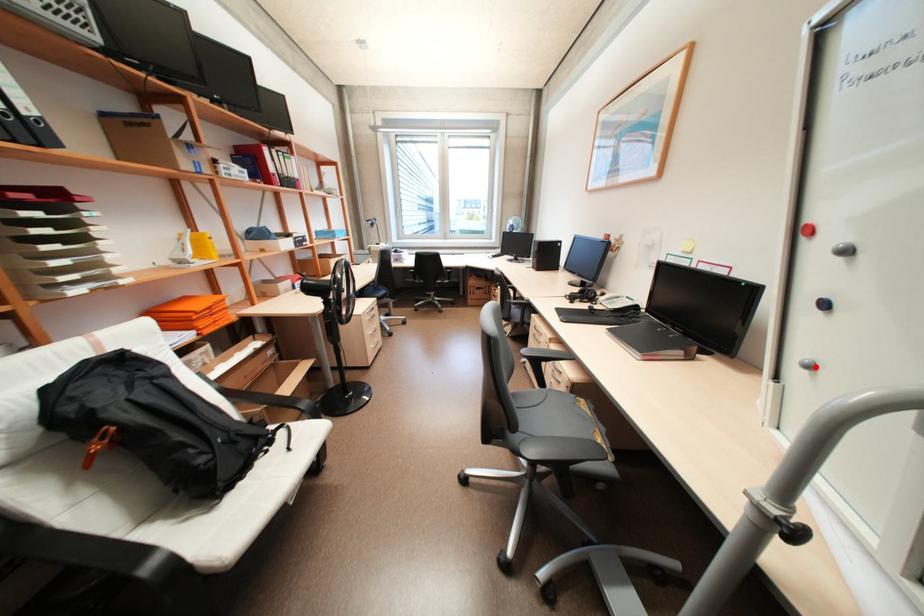
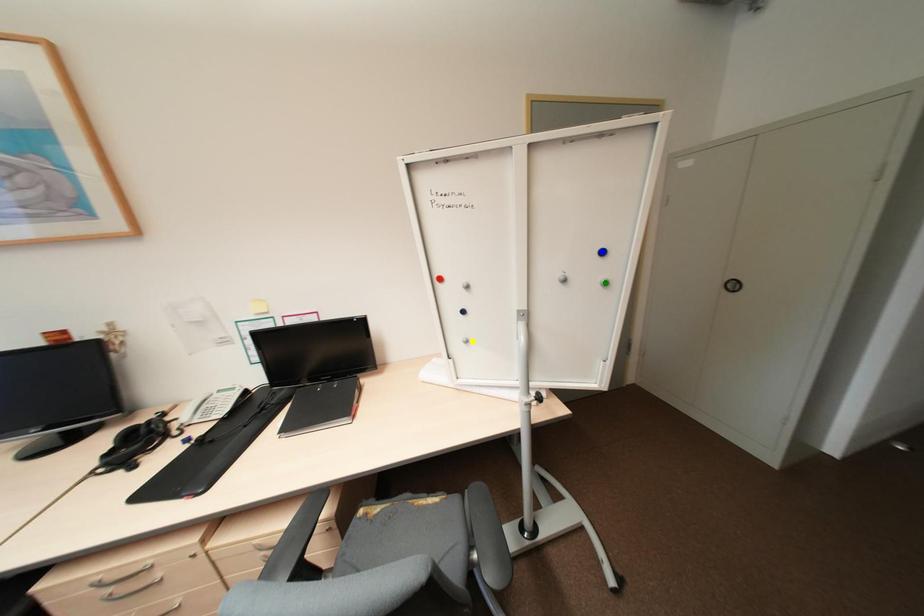
Question: I am providing you with two images of the same scene from different viewpoints. A red point is marked on the first image. You are given multiple points on the second image. Which spot in image 2 lines up with the point in image 1?

Choices:
 (A) yellow point
 (B) green point
 (C) blue point

Answer: (A)